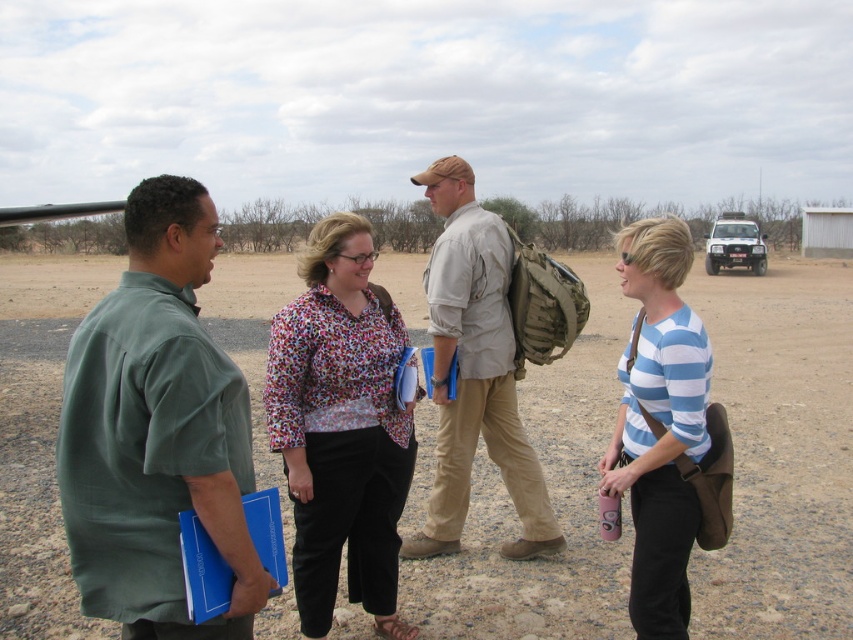
Can you confirm if floral fabric blouse at center is positioned above blue striped shirt at center?

Incorrect, floral fabric blouse at center is not positioned above blue striped shirt at center.

Describe the element at coordinates (341, 428) in the screenshot. I see `floral fabric blouse at center` at that location.

Locate an element on the screen. floral fabric blouse at center is located at coordinates (341, 428).

This screenshot has width=853, height=640. Identify the location of floral fabric blouse at center. (341, 428).

Is floral fabric blouse at center above khaki fabric shirt at center?

No, floral fabric blouse at center is not above khaki fabric shirt at center.

Does point (331, 403) come in front of point (532, 534)?

Yes, point (331, 403) is closer to viewer.

Does point (325, 564) come closer to viewer compared to point (465, 508)?

Yes, point (325, 564) is in front of point (465, 508).

You are a GUI agent. You are given a task and a screenshot of the screen. Output one action in this format:
    pyautogui.click(x=<x>, y=<y>)
    Task: Click on the floral fabric blouse at center
    The height and width of the screenshot is (640, 853).
    Given the screenshot: What is the action you would take?
    pyautogui.click(x=341, y=428)

Based on the photo, does dirt field at center appear on the left side of green matte shirt at left?

In fact, dirt field at center is to the right of green matte shirt at left.

Is point (766, 484) more distant than point (219, 445)?

Yes.

You are a GUI agent. You are given a task and a screenshot of the screen. Output one action in this format:
    pyautogui.click(x=<x>, y=<y>)
    Task: Click on the dirt field at center
    The width and height of the screenshot is (853, 640).
    Given the screenshot: What is the action you would take?
    pyautogui.click(x=781, y=451)